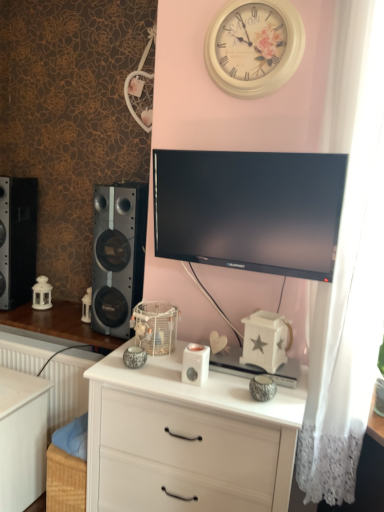
Question: Can you confirm if black matte speaker at left, the 2th speaker when ordered from left to right, is positioned to the left of white lace curtain at right?

Choices:
 (A) no
 (B) yes

Answer: (B)

Question: Does black matte speaker at left, the 2th speaker when ordered from left to right, have a greater height compared to white lace curtain at right?

Choices:
 (A) no
 (B) yes

Answer: (A)

Question: Is black matte speaker at left, the first speaker from the right, surrounding white lace curtain at right?

Choices:
 (A) no
 (B) yes

Answer: (A)

Question: Is black matte speaker at left, the 2th speaker when ordered from left to right, wider than white lace curtain at right?

Choices:
 (A) yes
 (B) no

Answer: (A)

Question: From a real-world perspective, is black matte speaker at left, the first speaker from the right, positioned under white lace curtain at right based on gravity?

Choices:
 (A) yes
 (B) no

Answer: (A)

Question: Is black matte speaker at left, the first speaker from the right, far from white lace curtain at right?

Choices:
 (A) yes
 (B) no

Answer: (A)

Question: Is the depth of white wood changing table at lower left greater than that of black matte speaker at left, the 2th speaker when ordered from left to right?

Choices:
 (A) yes
 (B) no

Answer: (B)

Question: Considering the relative sizes of white wood changing table at lower left and black matte speaker at left, the first speaker from the right, in the image provided, is white wood changing table at lower left smaller than black matte speaker at left, the first speaker from the right,?

Choices:
 (A) no
 (B) yes

Answer: (B)

Question: Is black matte speaker at left, the 2th speaker when ordered from left to right, surrounded by white wood changing table at lower left?

Choices:
 (A) yes
 (B) no

Answer: (B)

Question: Is white wood changing table at lower left looking in the opposite direction of black matte speaker at left, the first speaker from the right?

Choices:
 (A) yes
 (B) no

Answer: (B)

Question: From a real-world perspective, does white wood changing table at lower left sit lower than black matte speaker at left, the 2th speaker when ordered from left to right?

Choices:
 (A) no
 (B) yes

Answer: (B)

Question: From a real-world perspective, is white wood changing table at lower left on top of black matte speaker at left, the 2th speaker when ordered from left to right?

Choices:
 (A) no
 (B) yes

Answer: (A)

Question: Can white plastic ipod at center be found inside black matte speaker at left, the first speaker in the left-to-right sequence?

Choices:
 (A) no
 (B) yes

Answer: (A)